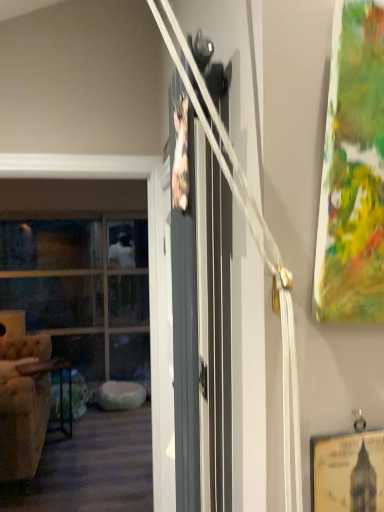
Question: Considering the relative sizes of metallic dark brown table at left and beige tufted armchair at left in the image provided, is metallic dark brown table at left bigger than beige tufted armchair at left?

Choices:
 (A) yes
 (B) no

Answer: (B)

Question: Does metallic dark brown table at left turn towards beige tufted armchair at left?

Choices:
 (A) yes
 (B) no

Answer: (A)

Question: From the image's perspective, is metallic dark brown table at left on beige tufted armchair at left?

Choices:
 (A) no
 (B) yes

Answer: (A)

Question: Is the depth of metallic dark brown table at left less than that of beige tufted armchair at left?

Choices:
 (A) yes
 (B) no

Answer: (B)

Question: Considering the relative sizes of metallic dark brown table at left and beige tufted armchair at left in the image provided, is metallic dark brown table at left shorter than beige tufted armchair at left?

Choices:
 (A) no
 (B) yes

Answer: (B)

Question: Can you confirm if metallic dark brown table at left is smaller than beige tufted armchair at left?

Choices:
 (A) yes
 (B) no

Answer: (A)

Question: Is beige tufted armchair at left not near matte gray barn door at center?

Choices:
 (A) yes
 (B) no

Answer: (A)

Question: Can you confirm if beige tufted armchair at left is wider than matte gray barn door at center?

Choices:
 (A) yes
 (B) no

Answer: (A)

Question: Is beige tufted armchair at left to the right of matte gray barn door at center from the viewer's perspective?

Choices:
 (A) no
 (B) yes

Answer: (A)

Question: Is beige tufted armchair at left facing towards matte gray barn door at center?

Choices:
 (A) no
 (B) yes

Answer: (A)

Question: From a real-world perspective, does beige tufted armchair at left stand above matte gray barn door at center?

Choices:
 (A) yes
 (B) no

Answer: (B)

Question: Is beige tufted armchair at left looking in the opposite direction of matte gray barn door at center?

Choices:
 (A) no
 (B) yes

Answer: (A)

Question: Can you confirm if metallic dark brown table at left is taller than clear glass window at left?

Choices:
 (A) yes
 (B) no

Answer: (B)